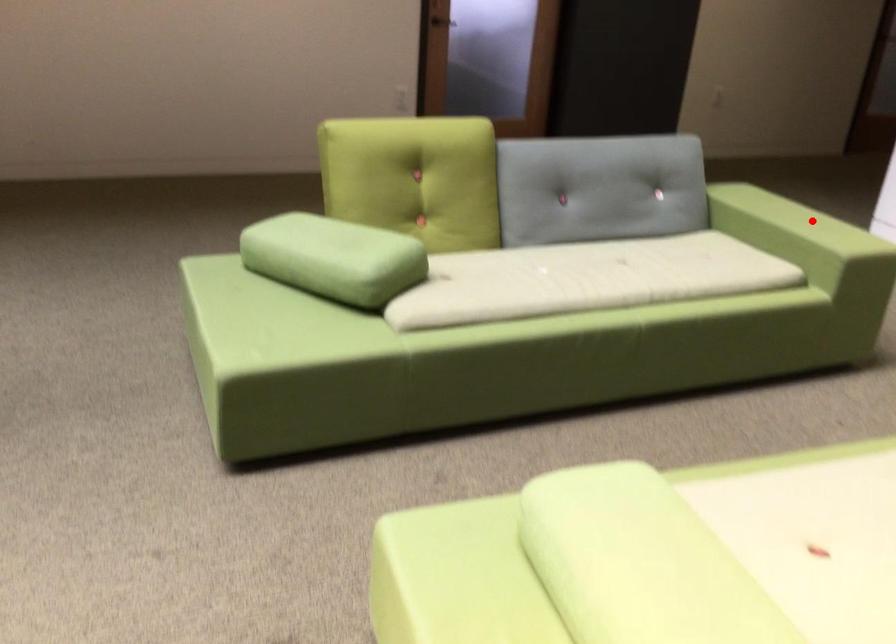
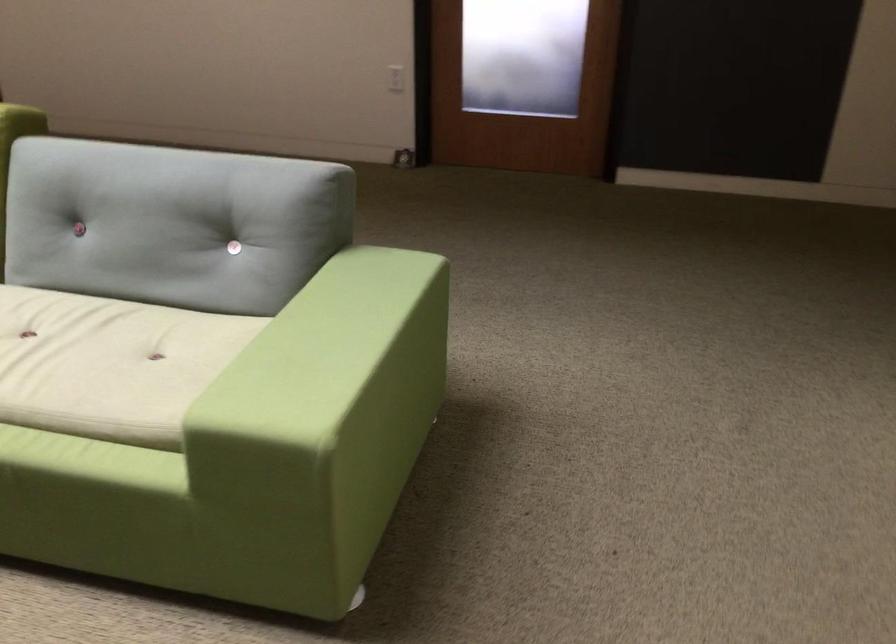
Question: I am providing you with two images of the same scene from different viewpoints. Image1 has a red point marked. In image2, the corresponding 3D location appears at what relative position? Reply with the corresponding letter.

Choices:
 (A) Closer
 (B) Farther

Answer: (A)